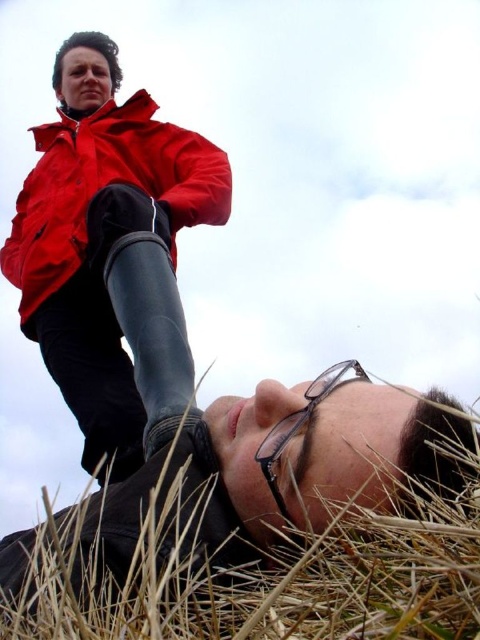
Question: Which of the following is the closest to the observer?

Choices:
 (A) matte red jacket at upper left
 (B) transparent plastic glasses at lower center
 (C) brown dry grass at lower center

Answer: (C)

Question: Among these points, which one is nearest to the camera?

Choices:
 (A) (465, 428)
 (B) (266, 480)

Answer: (A)

Question: Estimate the real-world distances between objects in this image. Which object is closer to the transparent plastic glasses at lower center?

Choices:
 (A) matte red jacket at upper left
 (B) brown dry grass at lower center

Answer: (B)

Question: Is matte red jacket at upper left to the right of transparent plastic glasses at lower center from the viewer's perspective?

Choices:
 (A) no
 (B) yes

Answer: (A)

Question: Can you confirm if brown dry grass at lower center is positioned to the right of transparent plastic glasses at lower center?

Choices:
 (A) yes
 (B) no

Answer: (B)

Question: Considering the relative positions of matte red jacket at upper left and transparent plastic glasses at lower center in the image provided, where is matte red jacket at upper left located with respect to transparent plastic glasses at lower center?

Choices:
 (A) below
 (B) above

Answer: (B)